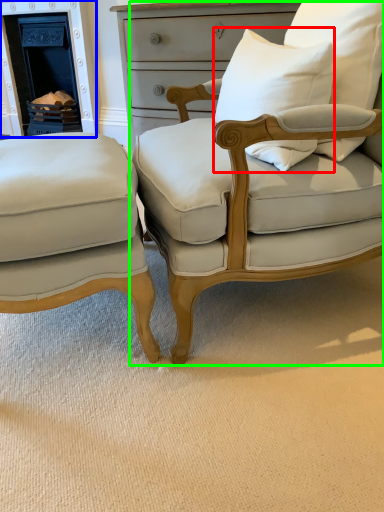
Question: Which is nearer to the pillow (highlighted by a red box)? fireplace (highlighted by a blue box) or chair (highlighted by a green box).

Choices:
 (A) fireplace
 (B) chair

Answer: (B)